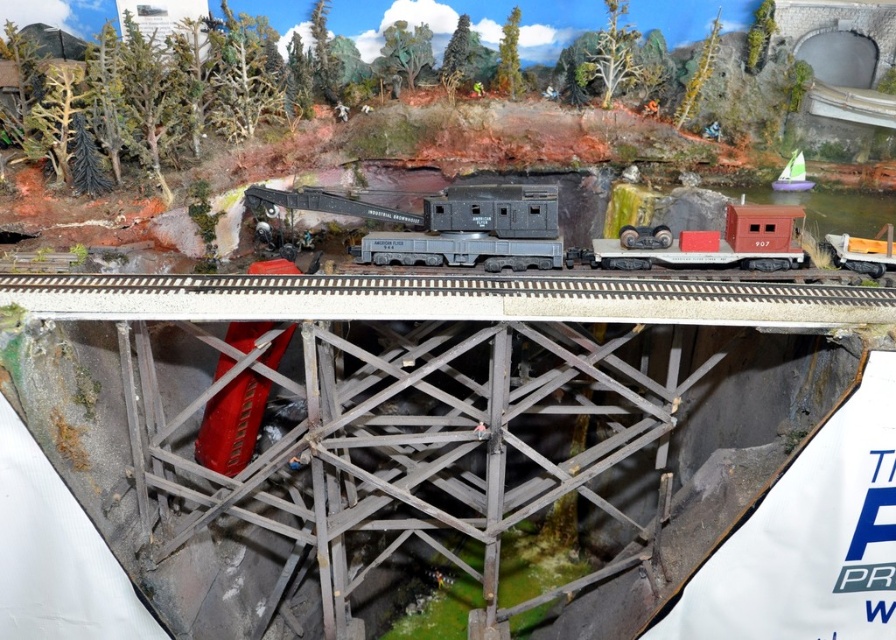
You are a model train enthusiast who wants to place a new train car on the track. Given the space available on the smooth gray train track at center and the presence of the matte black locomotive at center, can you fit the new car without removing any existing trains?

The smooth gray train track at center occupies less space than the matte black locomotive at center, so there might not be enough room to add a new train car without removing existing ones.

You are a model train enthusiast inspecting the diorama. You notice the smooth gray train track at center and the matte black locomotive at center. Which object has a lower height?

The smooth gray train track at center has a lesser height compared to the matte black locomotive at center, so the smooth gray train track at center is lower in height.